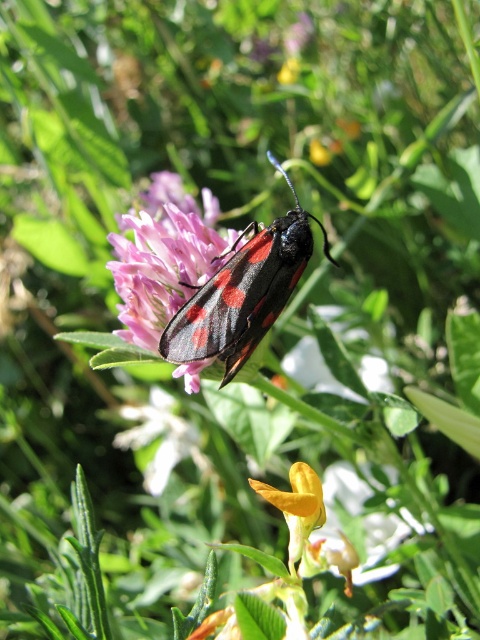
Question: From the image, what is the correct spatial relationship of matte black moth at center in relation to shiny black beetle at center?

Choices:
 (A) right
 (B) left

Answer: (B)

Question: Does smooth yellow flower at center appear under matte pink flower at center?

Choices:
 (A) yes
 (B) no

Answer: (A)

Question: Is matte black moth at center positioned in front of smooth yellow flower at center?

Choices:
 (A) no
 (B) yes

Answer: (B)

Question: Which object is positioned farthest from the smooth yellow flower at center?

Choices:
 (A) matte pink flower at center
 (B) shiny black beetle at center

Answer: (B)

Question: Which object appears farthest from the camera in this image?

Choices:
 (A) matte pink flower at center
 (B) matte black moth at center

Answer: (A)

Question: Which point is closer to the camera?

Choices:
 (A) (156, 330)
 (B) (295, 376)

Answer: (A)